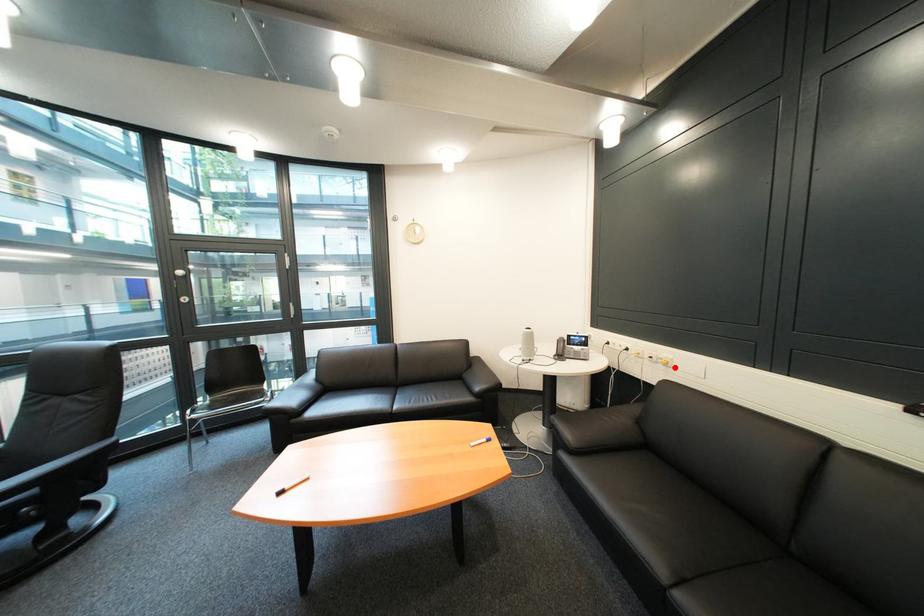
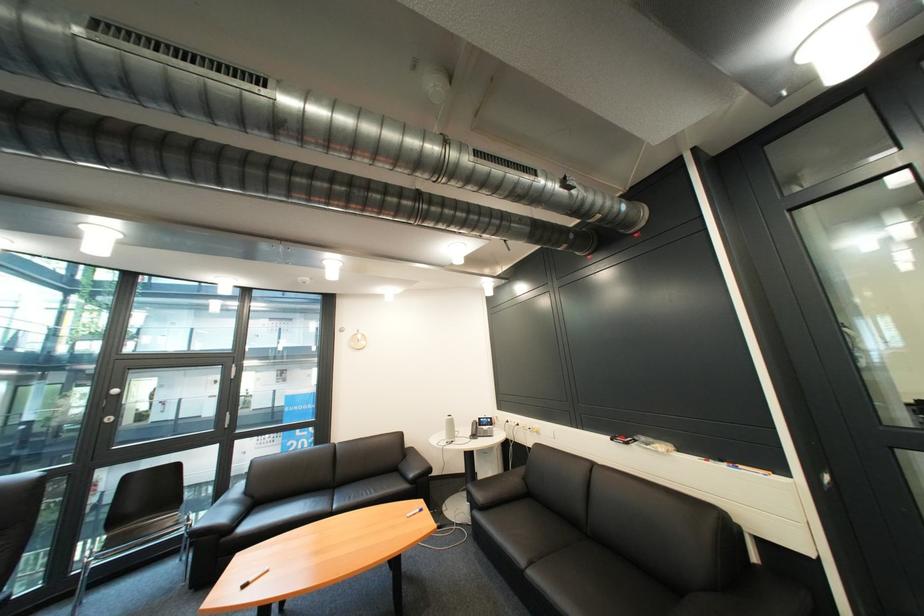
Where in the second image is the point corresponding to the highlighted location from the first image?

(549, 435)